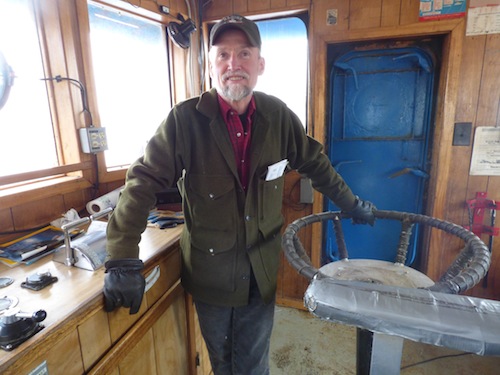
I want to click on door, so click(383, 95).